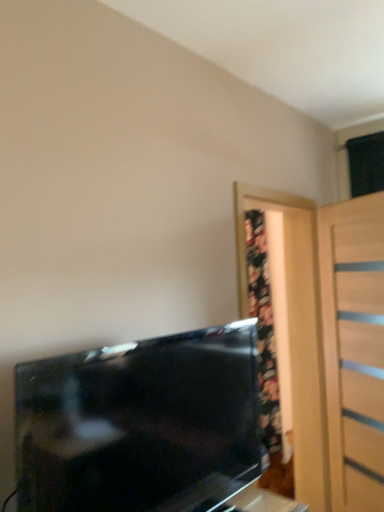
Question: Is matte black tv at lower left located within light wood door at right?

Choices:
 (A) yes
 (B) no

Answer: (B)

Question: Is light wood door at right bigger than matte black tv at lower left?

Choices:
 (A) yes
 (B) no

Answer: (A)

Question: Is light wood door at right positioned before matte black tv at lower left?

Choices:
 (A) yes
 (B) no

Answer: (B)

Question: Is matte black tv at lower left at the back of light wood door at right?

Choices:
 (A) yes
 (B) no

Answer: (B)

Question: From a real-world perspective, is light wood door at right beneath matte black tv at lower left?

Choices:
 (A) no
 (B) yes

Answer: (A)

Question: Is matte black tv at lower left taller or shorter than light wood door at right?

Choices:
 (A) short
 (B) tall

Answer: (A)

Question: In the image, is matte black tv at lower left positioned in front of or behind light wood door at right?

Choices:
 (A) front
 (B) behind

Answer: (A)

Question: Would you say matte black tv at lower left is to the left or to the right of light wood door at right in the picture?

Choices:
 (A) right
 (B) left

Answer: (B)

Question: Is matte black tv at lower left bigger or smaller than light wood door at right?

Choices:
 (A) small
 (B) big

Answer: (A)

Question: From the image's perspective, is black glossy tv at lower left above or below matte black tv at lower left?

Choices:
 (A) above
 (B) below

Answer: (A)

Question: Considering their positions, is black glossy tv at lower left located in front of or behind matte black tv at lower left?

Choices:
 (A) behind
 (B) front

Answer: (B)

Question: Is black glossy tv at lower left spatially inside matte black tv at lower left, or outside of it?

Choices:
 (A) outside
 (B) inside

Answer: (A)

Question: Is black glossy tv at lower left to the left or to the right of matte black tv at lower left in the image?

Choices:
 (A) left
 (B) right

Answer: (A)

Question: Is light wood door at right inside the boundaries of black glossy tv at lower left, or outside?

Choices:
 (A) inside
 (B) outside

Answer: (B)

Question: Visually, is light wood door at right positioned to the left or to the right of black glossy tv at lower left?

Choices:
 (A) right
 (B) left

Answer: (A)